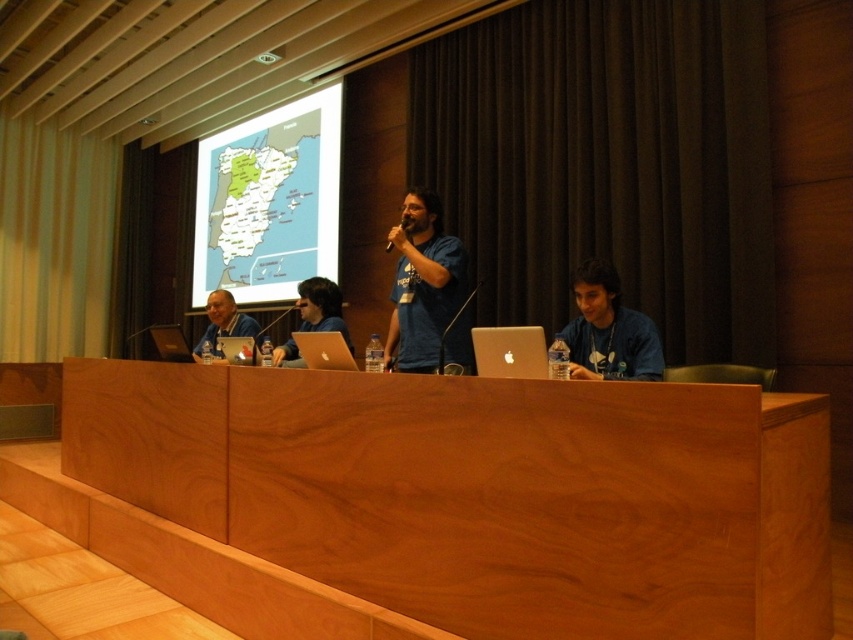
Can you confirm if green fabric curtain at upper left is shorter than blue fabric shirt at lower right?

No, green fabric curtain at upper left is not shorter than blue fabric shirt at lower right.

Does green fabric curtain at upper left have a smaller size compared to blue fabric shirt at lower right?

No.

Is point (13, 250) farther from camera compared to point (653, 346)?

That is True.

This screenshot has width=853, height=640. Identify the location of green fabric curtain at upper left. (54, 241).

From the picture: Can you confirm if blue cotton shirt at center is positioned to the right of silver metallic laptop at center?

In fact, blue cotton shirt at center is to the left of silver metallic laptop at center.

Does blue cotton shirt at center appear over silver metallic laptop at center?

Yes, blue cotton shirt at center is above silver metallic laptop at center.

Who is more forward, (x=454, y=262) or (x=498, y=342)?

Point (x=498, y=342) is more forward.

Image resolution: width=853 pixels, height=640 pixels. I want to click on blue cotton shirt at center, so click(x=427, y=291).

Which of these two, wooden table at center or blue fabric shirt at lower right, stands taller?

wooden table at center

Is wooden table at center above blue fabric shirt at lower right?

Incorrect, wooden table at center is not positioned above blue fabric shirt at lower right.

Describe the element at coordinates (485, 492) in the screenshot. I see `wooden table at center` at that location.

Identify the location of wooden table at center. The image size is (853, 640). (485, 492).